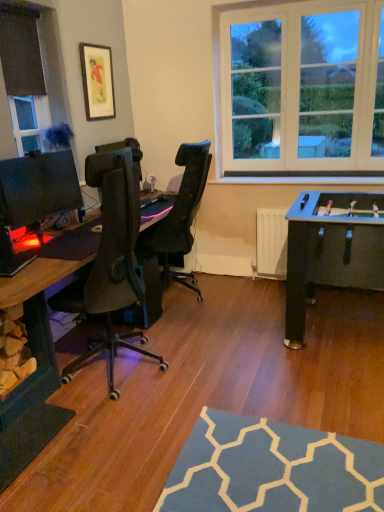
Question: Is black fabric at upper left looking in the opposite direction of matte gold picture frame at upper left?

Choices:
 (A) yes
 (B) no

Answer: (B)

Question: From a real-world perspective, is black fabric at upper left physically above matte gold picture frame at upper left?

Choices:
 (A) no
 (B) yes

Answer: (B)

Question: Is black fabric at upper left touching matte gold picture frame at upper left?

Choices:
 (A) no
 (B) yes

Answer: (A)

Question: From a real-world perspective, is black fabric at upper left under matte gold picture frame at upper left?

Choices:
 (A) yes
 (B) no

Answer: (B)

Question: Does black fabric at upper left appear on the left side of matte gold picture frame at upper left?

Choices:
 (A) yes
 (B) no

Answer: (A)

Question: In terms of size, does matte gold picture frame at upper left appear bigger or smaller than matte black desk at left?

Choices:
 (A) small
 (B) big

Answer: (A)

Question: From a real-world perspective, is matte gold picture frame at upper left positioned above or below matte black desk at left?

Choices:
 (A) below
 (B) above

Answer: (B)

Question: Does point (102, 93) appear closer or farther from the camera than point (23, 295)?

Choices:
 (A) closer
 (B) farther

Answer: (B)

Question: From the image's perspective, is matte gold picture frame at upper left above or below matte black desk at left?

Choices:
 (A) above
 (B) below

Answer: (A)

Question: Is point (99, 98) positioned closer to the camera than point (29, 177)?

Choices:
 (A) closer
 (B) farther

Answer: (B)

Question: Is matte gold picture frame at upper left inside the boundaries of matte black monitor at left, or outside?

Choices:
 (A) outside
 (B) inside

Answer: (A)

Question: From the image's perspective, relative to matte black monitor at left, is matte gold picture frame at upper left above or below?

Choices:
 (A) above
 (B) below

Answer: (A)

Question: From a real-world perspective, is matte gold picture frame at upper left physically located above or below matte black monitor at left?

Choices:
 (A) above
 (B) below

Answer: (A)

Question: Considering the positions of matte gold picture frame at upper left and black fabric at upper left in the image, is matte gold picture frame at upper left taller or shorter than black fabric at upper left?

Choices:
 (A) short
 (B) tall

Answer: (B)

Question: Is matte gold picture frame at upper left inside the boundaries of black fabric at upper left, or outside?

Choices:
 (A) inside
 (B) outside

Answer: (B)